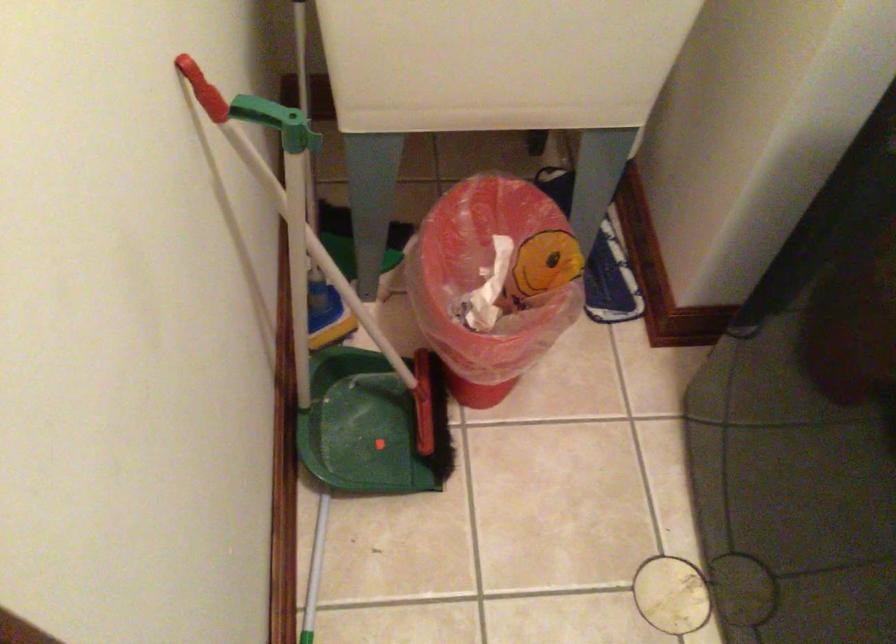
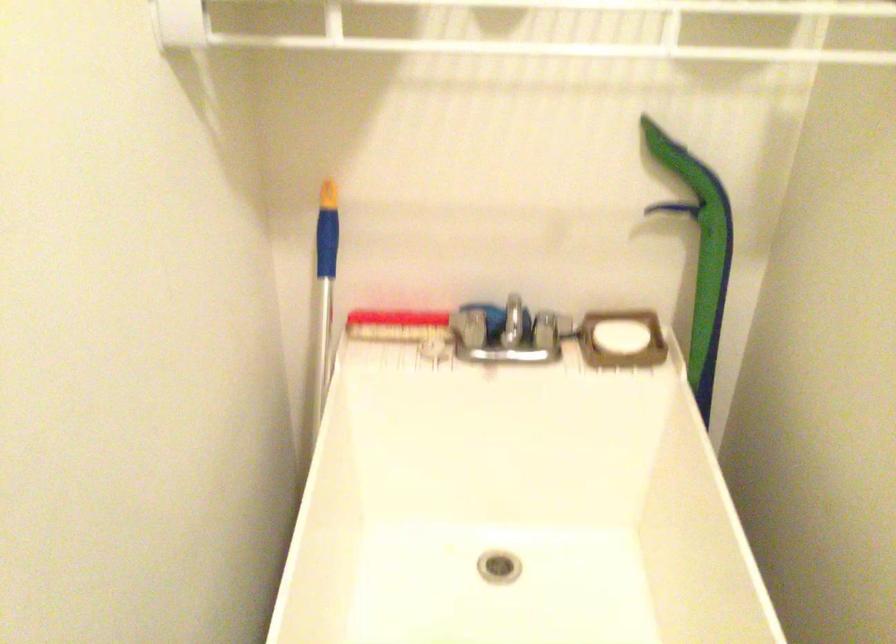
Question: In a continuous first-person perspective shot, in which direction is the camera moving?

Choices:
 (A) Left
 (B) Right
 (C) Forward
 (D) Backward

Answer: (B)